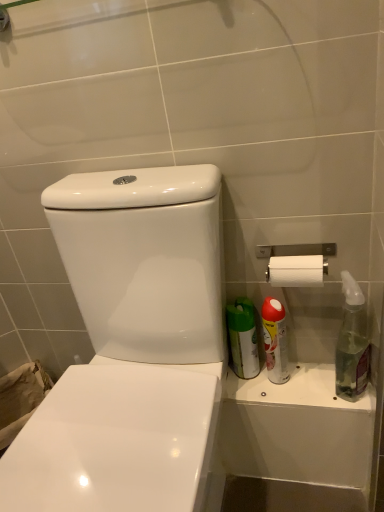
Image resolution: width=384 pixels, height=512 pixels. In order to click on vacant area that is in front of red matte spray can at right, positioned as the first cleaning product in left-to-right order in this screenshot , I will do pos(304,396).